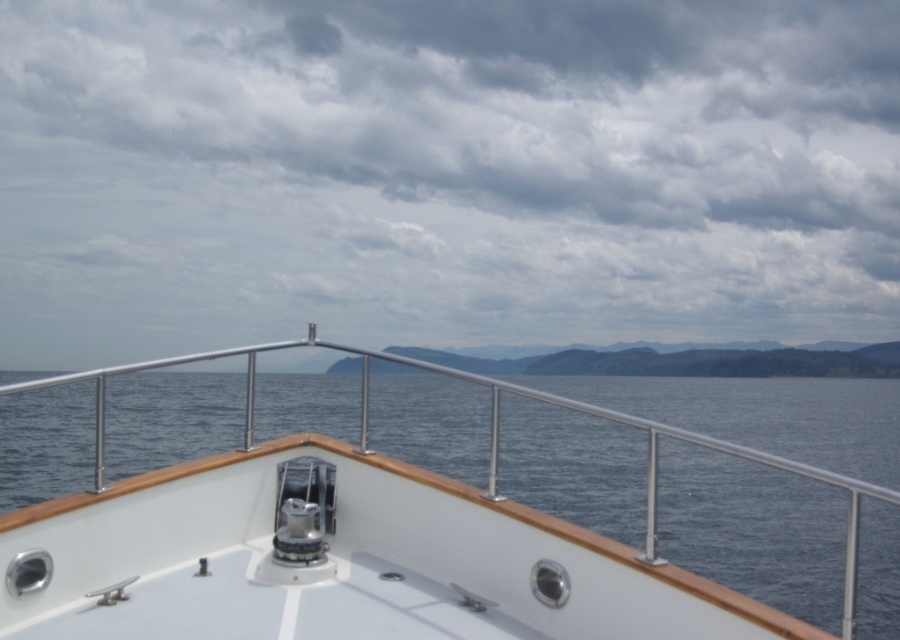
In the scene shown: Does cloudy sky at upper center appear on the left side of white polished wood boat at center?

Correct, you'll find cloudy sky at upper center to the left of white polished wood boat at center.

Where is `cloudy sky at upper center`? This screenshot has height=640, width=900. cloudy sky at upper center is located at coordinates (446, 172).